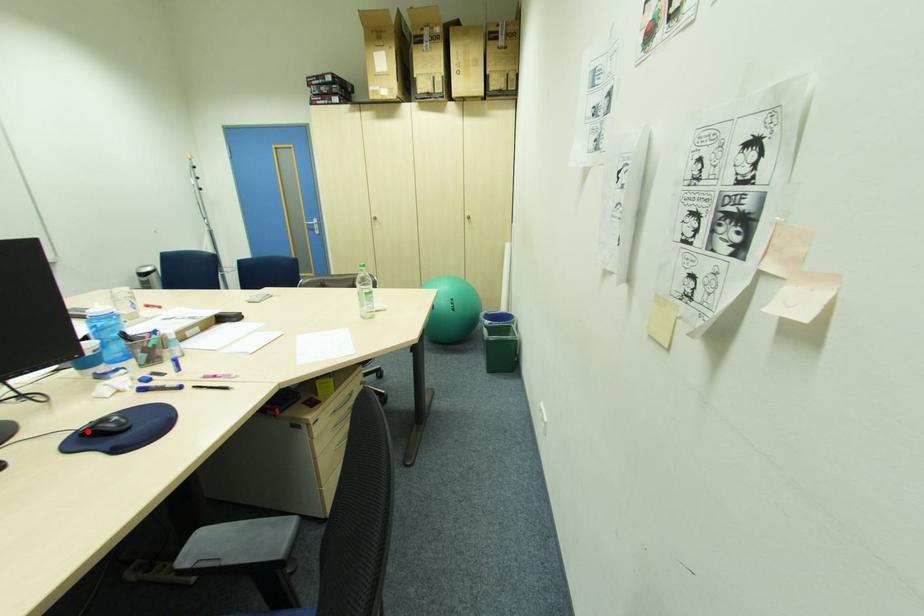
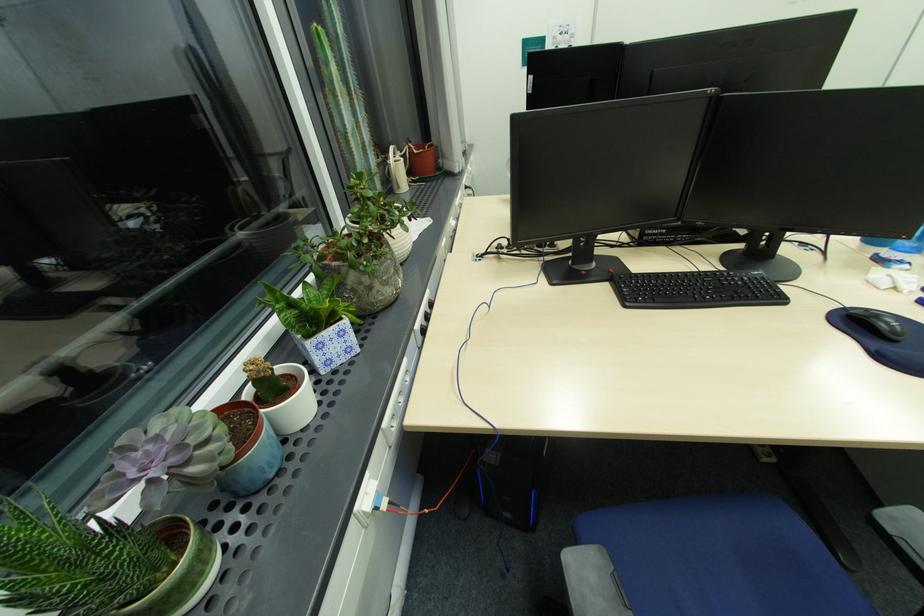
Find the pixel in the second image that matches the highlighted location in the first image.

(857, 312)